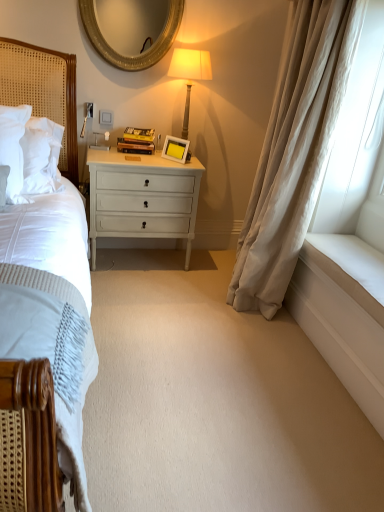
Question: Is matte gold lamp at upper center not close to white matte picture frame at center?

Choices:
 (A) yes
 (B) no

Answer: (B)

Question: Can you confirm if matte gold lamp at upper center is positioned to the left of white matte picture frame at center?

Choices:
 (A) no
 (B) yes

Answer: (A)

Question: Does matte gold lamp at upper center have a lesser height compared to white matte picture frame at center?

Choices:
 (A) no
 (B) yes

Answer: (A)

Question: From the image's perspective, would you say matte gold lamp at upper center is positioned over white matte picture frame at center?

Choices:
 (A) yes
 (B) no

Answer: (A)

Question: Does matte gold lamp at upper center have a smaller size compared to white matte picture frame at center?

Choices:
 (A) yes
 (B) no

Answer: (B)

Question: From the image's perspective, is white painted wood chest of drawers at center located above or below matte gold lamp at upper center?

Choices:
 (A) below
 (B) above

Answer: (A)

Question: In terms of height, does white painted wood chest of drawers at center look taller or shorter compared to matte gold lamp at upper center?

Choices:
 (A) tall
 (B) short

Answer: (A)

Question: From a real-world perspective, is white painted wood chest of drawers at center above or below matte gold lamp at upper center?

Choices:
 (A) below
 (B) above

Answer: (A)

Question: Considering their positions, is white painted wood chest of drawers at center located in front of or behind matte gold lamp at upper center?

Choices:
 (A) front
 (B) behind

Answer: (B)

Question: Is matte gold lamp at upper center spatially inside beige silk curtain at right, or outside of it?

Choices:
 (A) inside
 (B) outside

Answer: (B)

Question: Is point (188, 86) positioned closer to the camera than point (276, 219)?

Choices:
 (A) closer
 (B) farther

Answer: (B)

Question: Based on their sizes in the image, would you say matte gold lamp at upper center is bigger or smaller than beige silk curtain at right?

Choices:
 (A) big
 (B) small

Answer: (B)

Question: Is matte gold lamp at upper center to the left or to the right of beige silk curtain at right in the image?

Choices:
 (A) left
 (B) right

Answer: (A)

Question: Is point (61, 60) positioned closer to the camera than point (175, 201)?

Choices:
 (A) farther
 (B) closer

Answer: (B)

Question: In the image, is woven wood headboard at left on the left side or the right side of white painted wood chest of drawers at center?

Choices:
 (A) right
 (B) left

Answer: (B)